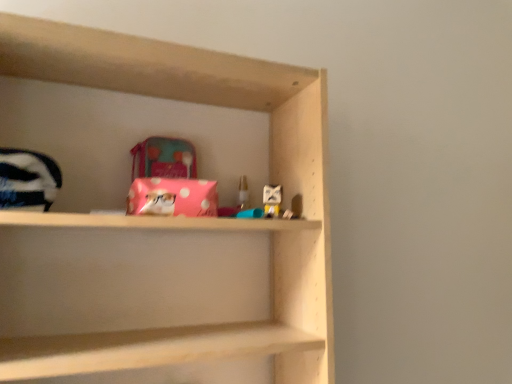
Question: Is translucent plastic candle at center, positioned as the first toy in back-to-front order, positioned behind pink polka dot plush at upper center, the 2th toy when ordered from back to front?

Choices:
 (A) no
 (B) yes

Answer: (B)

Question: Is pink polka dot plush at upper center, the first toy positioned from the front, inside translucent plastic candle at center, positioned as the first toy in back-to-front order?

Choices:
 (A) yes
 (B) no

Answer: (B)

Question: Are translucent plastic candle at center, positioned as the first toy in back-to-front order, and pink polka dot plush at upper center, the first toy viewed from the right, far apart?

Choices:
 (A) yes
 (B) no

Answer: (B)

Question: Is translucent plastic candle at center, which ranks as the 2th toy in front-to-back order, aimed at pink polka dot plush at upper center, the 2th toy when ordered from back to front?

Choices:
 (A) no
 (B) yes

Answer: (B)

Question: From a real-world perspective, is translucent plastic candle at center, positioned as the first toy in back-to-front order, beneath pink polka dot plush at upper center, the first toy positioned from the front?

Choices:
 (A) no
 (B) yes

Answer: (A)

Question: Considering their positions, is translucent plastic candle at center, which ranks as the 2th toy in front-to-back order, located in front of or behind pink polka dot fabric at center?

Choices:
 (A) front
 (B) behind

Answer: (B)

Question: From their relative heights in the image, would you say translucent plastic candle at center, which appears as the first toy when viewed from the left, is taller or shorter than pink polka dot fabric at center?

Choices:
 (A) short
 (B) tall

Answer: (A)

Question: Considering the positions of translucent plastic candle at center, which ranks as the 2th toy in front-to-back order, and pink polka dot fabric at center in the image, is translucent plastic candle at center, which ranks as the 2th toy in front-to-back order, bigger or smaller than pink polka dot fabric at center?

Choices:
 (A) small
 (B) big

Answer: (A)

Question: Which is correct: translucent plastic candle at center, which ranks as the 2th toy in front-to-back order, is inside pink polka dot fabric at center, or outside of it?

Choices:
 (A) outside
 (B) inside

Answer: (A)

Question: From the image's perspective, is pink polka dot fabric at center positioned above or below translucent plastic candle at center, positioned as the first toy in back-to-front order?

Choices:
 (A) below
 (B) above

Answer: (A)

Question: From a real-world perspective, relative to translucent plastic candle at center, positioned as the first toy in back-to-front order, is pink polka dot fabric at center vertically above or below?

Choices:
 (A) above
 (B) below

Answer: (B)

Question: Is pink polka dot fabric at center taller or shorter than translucent plastic candle at center, placed as the 2th toy when sorted from right to left?

Choices:
 (A) short
 (B) tall

Answer: (B)

Question: Based on their sizes in the image, would you say pink polka dot fabric at center is bigger or smaller than translucent plastic candle at center, placed as the 2th toy when sorted from right to left?

Choices:
 (A) big
 (B) small

Answer: (A)

Question: Considering their positions, is pink polka dot plush at upper center, the first toy positioned from the front, located in front of or behind pink polka dot fabric at center?

Choices:
 (A) front
 (B) behind

Answer: (B)

Question: Looking at their shapes, would you say pink polka dot plush at upper center, the first toy positioned from the front, is wider or thinner than pink polka dot fabric at center?

Choices:
 (A) wide
 (B) thin

Answer: (B)